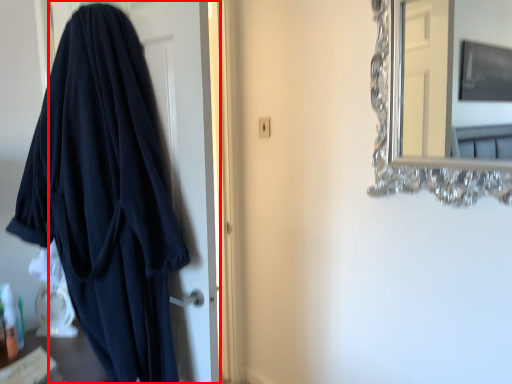
Question: From the image's perspective, what is the correct spatial positioning of door (annotated by the red box) in reference to mirror?

Choices:
 (A) below
 (B) above

Answer: (A)